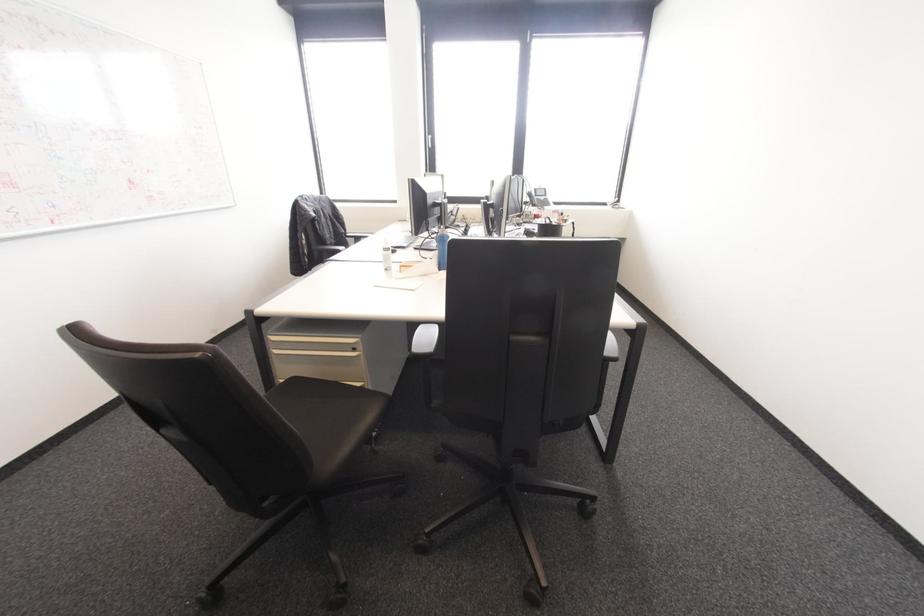
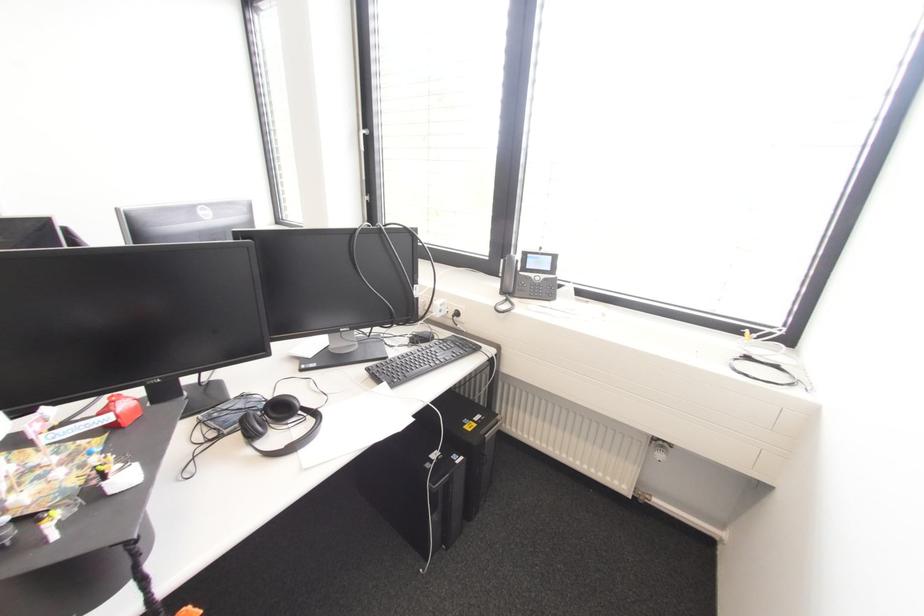
The point at (532, 205) is marked in the first image. Where is the corresponding point in the second image?

(503, 292)